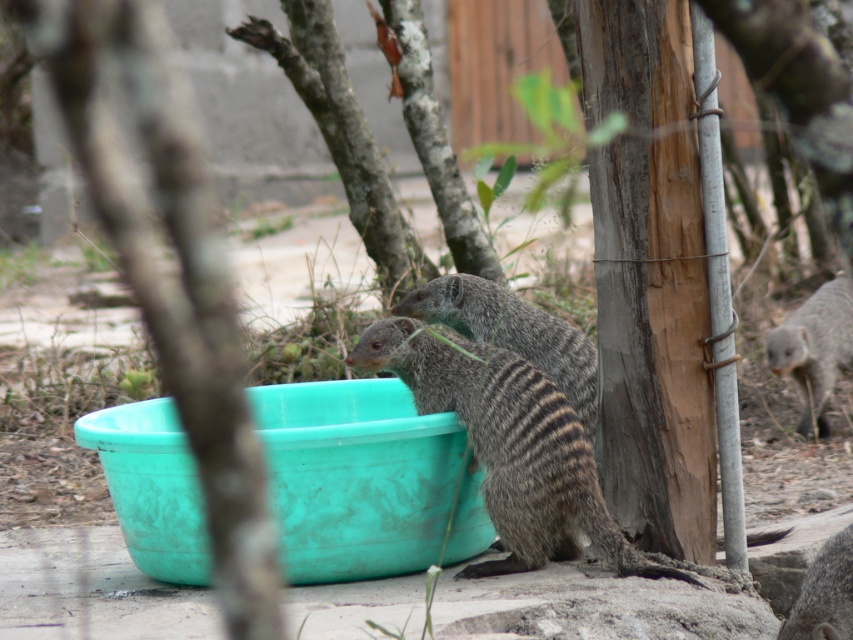
Question: Which object appears farthest from the camera in this image?

Choices:
 (A) green plastic bucket at lower center
 (B) gray fur at right
 (C) gray-brown fur mongoose at center
 (D) gray fur at center

Answer: (A)

Question: Is gray fur at right positioned at the back of gray fur at center?

Choices:
 (A) no
 (B) yes

Answer: (B)

Question: Considering the real-world distances, which object is closest to the gray fur at center?

Choices:
 (A) green plastic bucket at lower center
 (B) gray-brown fur mongoose at center

Answer: (B)

Question: Is green plastic bucket at lower center wider than gray-brown fur mongoose at center?

Choices:
 (A) no
 (B) yes

Answer: (A)

Question: Which of the following is the farthest from the observer?

Choices:
 (A) gray fur at center
 (B) gray-brown fur mongoose at center

Answer: (B)

Question: In this image, where is green plastic bucket at lower center located relative to gray fur at right?

Choices:
 (A) above
 (B) below

Answer: (A)